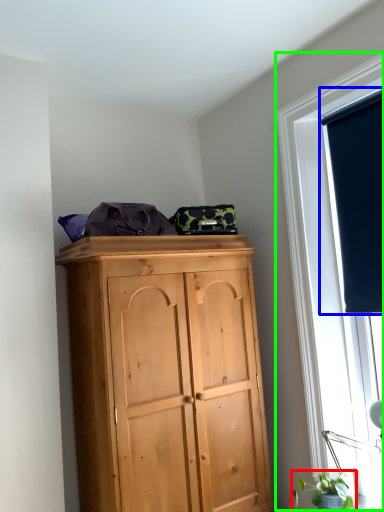
Question: Based on their relative distances, which object is nearer to plant (highlighted by a red box)? Choose from window screen (highlighted by a blue box) and window (highlighted by a green box).

Choices:
 (A) window screen
 (B) window

Answer: (B)